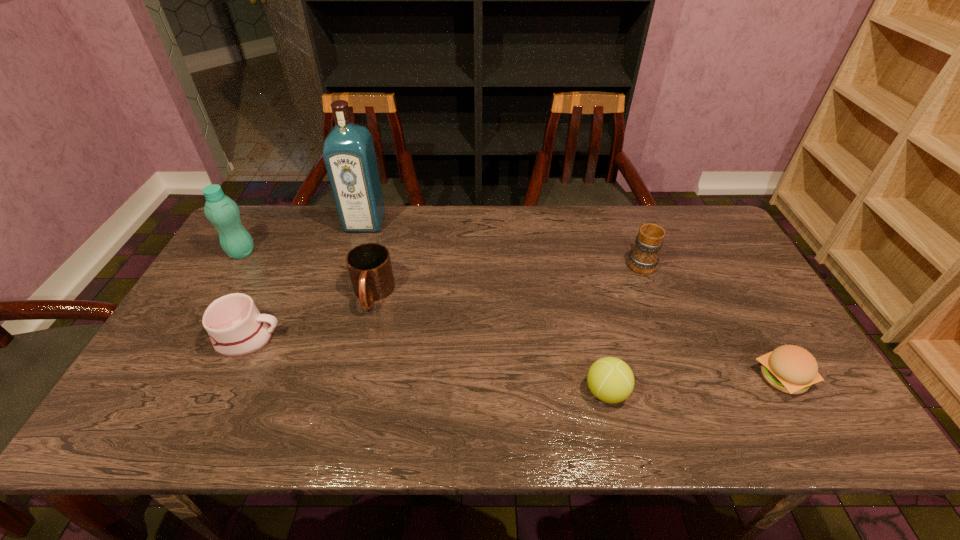
Identify the location of vacant space located 0.250m on the flat label side of the tallest object. Image resolution: width=960 pixels, height=540 pixels. (345, 288).

Locate an element on the screen. The image size is (960, 540). blank space located 0.240m on the right of the second tallest object is located at coordinates tap(332, 252).

At what (x,y) coordinates should I click in order to perform the action: click on vacant space located 0.200m on the side of the sixth object from left to right with the handle. Please return your answer as a coordinate pair (x, y). Looking at the image, I should click on (620, 211).

Where is `vacant space located on the side of the sixth object from left to right with the handle`? The image size is (960, 540). vacant space located on the side of the sixth object from left to right with the handle is located at coordinates (623, 218).

Find the location of a particular element. vacant space located 0.160m on the side of the sixth object from left to right with the handle is located at coordinates (623, 218).

This screenshot has width=960, height=540. What are the coordinates of `vacant space positioned 0.200m on the side of the second mug from right to left with the handle` in the screenshot? It's located at (351, 383).

You are a GUI agent. You are given a task and a screenshot of the screen. Output one action in this format:
    pyautogui.click(x=<x>, y=<y>)
    Task: Click on the vacant space situated on the side with the handle of the nearest mug
    The width and height of the screenshot is (960, 540).
    Given the screenshot: What is the action you would take?
    [423, 338]

Where is `vacant position located 0.350m on the right of the tennis ball`? The width and height of the screenshot is (960, 540). vacant position located 0.350m on the right of the tennis ball is located at coordinates tap(778, 392).

At what (x,y) coordinates should I click in order to perform the action: click on vacant region located on the left of the hamburger. Please return your answer as a coordinate pair (x, y). Image resolution: width=960 pixels, height=540 pixels. Looking at the image, I should click on (693, 377).

I want to click on liquor situated at the far edge, so click(x=349, y=154).